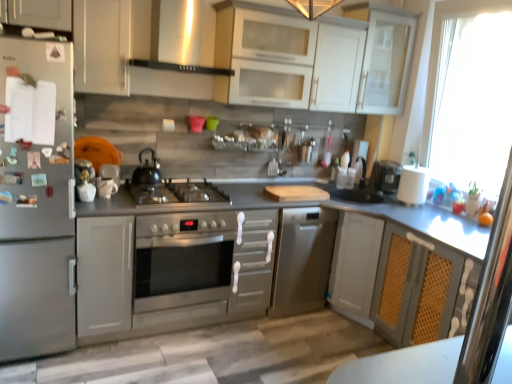
Question: From the image's perspective, is black matte kettle at center located above or below white matte paper towel at right?

Choices:
 (A) below
 (B) above

Answer: (B)

Question: Considering the positions of black matte kettle at center and white matte paper towel at right in the image, is black matte kettle at center taller or shorter than white matte paper towel at right?

Choices:
 (A) tall
 (B) short

Answer: (B)

Question: Which is farther from the white matte paper towel at right?

Choices:
 (A) satin gray cabinet at center, which ranks as the first cabinetry in left-to-right order
 (B) stainless steel oven at center
 (C) white matte cabinet at upper left, which appears as the second cabinetry when viewed from the top
 (D) satin silver refrigerator at left
 (E) clear glass screen door at right

Answer: (D)

Question: Which object is the closest to the white matte cabinet at upper left, the 2th cabinetry when ordered from left to right?

Choices:
 (A) transparent glass cabinet at upper right
 (B) white glossy coffee cup at center
 (C) white glossy cabinet at upper center, positioned as the first cabinetry in right-to-left order
 (D) satin silver refrigerator at left
 (E) white matte paper towel at right

Answer: (D)